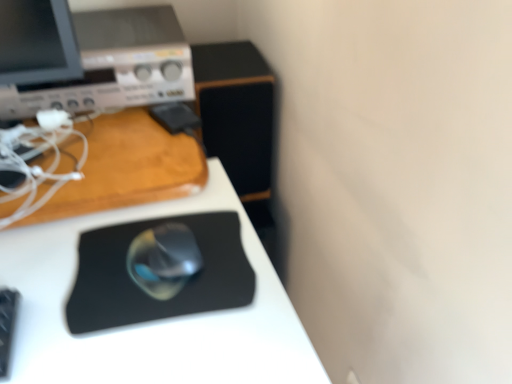
The width and height of the screenshot is (512, 384). I want to click on vacant region in front of matte silver desktop computer at upper left, so 100,157.